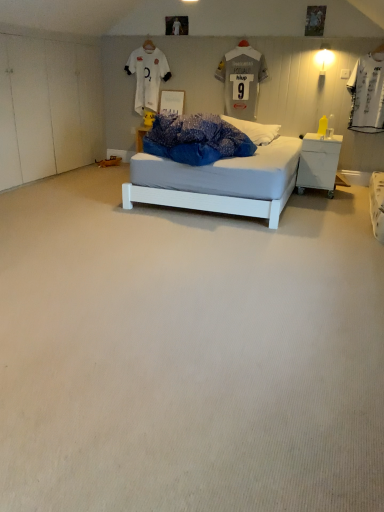
This screenshot has height=512, width=384. What do you see at coordinates (242, 80) in the screenshot?
I see `gray fabric jersey at upper center, which ranks as the second t shirt in left-to-right order` at bounding box center [242, 80].

Describe the element at coordinates (147, 75) in the screenshot. The image size is (384, 512). I see `white jersey at upper center, placed as the second t shirt when sorted from right to left` at that location.

Measure the distance between white carpet at center and camera.

1.16 meters.

The width and height of the screenshot is (384, 512). What are the coordinates of `gray fabric jersey at upper center, which ranks as the second t shirt in left-to-right order` in the screenshot? It's located at (242, 80).

In the scene shown: Can you confirm if white jersey at upper center, which is the 1th t shirt in left-to-right order, is bigger than white plastic nightstand at right?

Incorrect, white jersey at upper center, which is the 1th t shirt in left-to-right order, is not larger than white plastic nightstand at right.

Considering the positions of objects white jersey at upper center, placed as the second t shirt when sorted from right to left, and white plastic nightstand at right in the image provided, who is more to the left, white jersey at upper center, placed as the second t shirt when sorted from right to left, or white plastic nightstand at right?

white jersey at upper center, placed as the second t shirt when sorted from right to left.

Is white jersey at upper center, which is the 1th t shirt in left-to-right order, taller or shorter than white plastic nightstand at right?

white jersey at upper center, which is the 1th t shirt in left-to-right order, is taller than white plastic nightstand at right.

Considering the sizes of objects gray fabric jersey at upper center, the first t shirt from the right, and white plastic nightstand at right in the image provided, who is thinner, gray fabric jersey at upper center, the first t shirt from the right, or white plastic nightstand at right?

Thinner between the two is gray fabric jersey at upper center, the first t shirt from the right.

Based on the photo, from a real-world perspective, is gray fabric jersey at upper center, which ranks as the second t shirt in left-to-right order, positioned over white plastic nightstand at right based on gravity?

Indeed, from a real-world perspective, gray fabric jersey at upper center, which ranks as the second t shirt in left-to-right order, stands above white plastic nightstand at right.

Does point (228, 110) appear closer or farther from the camera than point (331, 186)?

Clearly, point (228, 110) is more distant from the camera than point (331, 186).

From the image's perspective, which one is positioned higher, gray fabric jersey at upper center, the first t shirt from the right, or white plastic nightstand at right?

gray fabric jersey at upper center, the first t shirt from the right, from the image's perspective.

Considering the relative sizes of white plastic nightstand at right and gray fabric jersey at upper center, the first t shirt from the right, in the image provided, is white plastic nightstand at right thinner than gray fabric jersey at upper center, the first t shirt from the right,?

No, white plastic nightstand at right is not thinner than gray fabric jersey at upper center, the first t shirt from the right.

Is point (311, 157) closer to camera compared to point (241, 83)?

That is True.

Does white carpet at center turn towards white plastic nightstand at right?

No, white carpet at center is not turned towards white plastic nightstand at right.

Would you say white carpet at center is outside white plastic nightstand at right?

Yes, white carpet at center is outside of white plastic nightstand at right.

Which of these two, white carpet at center or gray fabric jersey at upper center, which ranks as the second t shirt in left-to-right order, stands shorter?

white carpet at center is shorter.

Does white carpet at center have a lesser width compared to gray fabric jersey at upper center, which ranks as the second t shirt in left-to-right order?

Incorrect, the width of white carpet at center is not less than that of gray fabric jersey at upper center, which ranks as the second t shirt in left-to-right order.

Which of these two, white carpet at center or gray fabric jersey at upper center, the first t shirt from the right, is smaller?

With smaller size is gray fabric jersey at upper center, the first t shirt from the right.

Would you say white carpet at center contains gray fabric jersey at upper center, which ranks as the second t shirt in left-to-right order?

No, gray fabric jersey at upper center, which ranks as the second t shirt in left-to-right order, is not surrounded by white carpet at center.

Who is bigger, white jersey at upper center, which is the 1th t shirt in left-to-right order, or white carpet at center?

With larger size is white carpet at center.

Choose the correct answer: Is white jersey at upper center, which is the 1th t shirt in left-to-right order, inside white carpet at center or outside it?

white jersey at upper center, which is the 1th t shirt in left-to-right order, is not enclosed by white carpet at center.

From the picture: How different are the orientations of white jersey at upper center, which is the 1th t shirt in left-to-right order, and white carpet at center in degrees?

They differ by 0.945 degrees in their facing directions.

Which point is more distant from viewer, (138, 106) or (211, 426)?

The point (138, 106) is more distant.

Does white jersey at upper center, which is the 1th t shirt in left-to-right order, lie in front of gray fabric jersey at upper center, which ranks as the second t shirt in left-to-right order?

No, it is not.

Would you say white jersey at upper center, which is the 1th t shirt in left-to-right order, is outside gray fabric jersey at upper center, the first t shirt from the right?

Yes, white jersey at upper center, which is the 1th t shirt in left-to-right order, is outside of gray fabric jersey at upper center, the first t shirt from the right.

Is white jersey at upper center, placed as the second t shirt when sorted from right to left, to the left of gray fabric jersey at upper center, which ranks as the second t shirt in left-to-right order, from the viewer's perspective?

Correct, you'll find white jersey at upper center, placed as the second t shirt when sorted from right to left, to the left of gray fabric jersey at upper center, which ranks as the second t shirt in left-to-right order.

At what (x,y) coordinates should I click in order to perform the action: click on nightstand lying in front of the white jersey at upper center, placed as the second t shirt when sorted from right to left. Please return your answer as a coordinate pair (x, y). This screenshot has width=384, height=512. Looking at the image, I should click on (318, 163).

Locate an element on the screen. t shirt that is the 1st one when counting leftward from the white plastic nightstand at right is located at coordinates (242, 80).

Considering their positions, is gray fabric jersey at upper center, the first t shirt from the right, positioned closer to white jersey at upper center, placed as the second t shirt when sorted from right to left, than white plastic nightstand at right?

gray fabric jersey at upper center, the first t shirt from the right, lies closer to white jersey at upper center, placed as the second t shirt when sorted from right to left, than the other object.

Looking at the image, which one is located further to white jersey at upper center, which is the 1th t shirt in left-to-right order, white plastic nightstand at right or gray fabric jersey at upper center, which ranks as the second t shirt in left-to-right order?

The object further to white jersey at upper center, which is the 1th t shirt in left-to-right order, is white plastic nightstand at right.

Estimate the real-world distances between objects in this image. Which object is closer to white jersey at upper center, placed as the second t shirt when sorted from right to left, white carpet at center or white plastic nightstand at right?

white plastic nightstand at right lies closer to white jersey at upper center, placed as the second t shirt when sorted from right to left, than the other object.

Considering their positions, is white plastic nightstand at right positioned further to white carpet at center than white jersey at upper center, which is the 1th t shirt in left-to-right order?

Among the two, white jersey at upper center, which is the 1th t shirt in left-to-right order, is located further to white carpet at center.

From the image, which object appears to be nearer to white plastic nightstand at right, gray fabric jersey at upper center, which ranks as the second t shirt in left-to-right order, or white jersey at upper center, which is the 1th t shirt in left-to-right order?

gray fabric jersey at upper center, which ranks as the second t shirt in left-to-right order, is closer to white plastic nightstand at right.

Estimate the real-world distances between objects in this image. Which object is closer to gray fabric jersey at upper center, the first t shirt from the right, white plastic nightstand at right or white carpet at center?

Based on the image, white plastic nightstand at right appears to be nearer to gray fabric jersey at upper center, the first t shirt from the right.

In the scene shown: From the image, which object appears to be nearer to gray fabric jersey at upper center, which ranks as the second t shirt in left-to-right order, white carpet at center or white jersey at upper center, which is the 1th t shirt in left-to-right order?

white jersey at upper center, which is the 1th t shirt in left-to-right order, is closer to gray fabric jersey at upper center, which ranks as the second t shirt in left-to-right order.

Considering their positions, is white plastic nightstand at right positioned further to gray fabric jersey at upper center, which ranks as the second t shirt in left-to-right order, than white jersey at upper center, placed as the second t shirt when sorted from right to left?

Based on the image, white plastic nightstand at right appears to be further to gray fabric jersey at upper center, which ranks as the second t shirt in left-to-right order.

Identify the location of nightstand between white carpet at center and white jersey at upper center, which is the 1th t shirt in left-to-right order, from front to back. The image size is (384, 512). (318, 163).

The image size is (384, 512). Identify the location of t shirt located between white carpet at center and white jersey at upper center, placed as the second t shirt when sorted from right to left, in the depth direction. (242, 80).

You are a GUI agent. You are given a task and a screenshot of the screen. Output one action in this format:
    pyautogui.click(x=<x>, y=<y>)
    Task: Click on the nightstand between white carpet at center and gray fabric jersey at upper center, the first t shirt from the right, from front to back
    This screenshot has height=512, width=384.
    Given the screenshot: What is the action you would take?
    pyautogui.click(x=318, y=163)

Image resolution: width=384 pixels, height=512 pixels. I want to click on t shirt located between white jersey at upper center, which is the 1th t shirt in left-to-right order, and white plastic nightstand at right in the left-right direction, so pos(242,80).